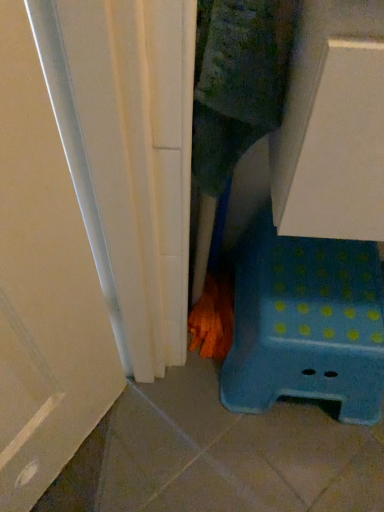
Question: Is orange textured broom at lower center to the right of blue plastic stool at lower right from the viewer's perspective?

Choices:
 (A) no
 (B) yes

Answer: (A)

Question: Is there a large distance between orange textured broom at lower center and blue plastic stool at lower right?

Choices:
 (A) no
 (B) yes

Answer: (A)

Question: Considering the relative sizes of orange textured broom at lower center and blue plastic stool at lower right in the image provided, is orange textured broom at lower center smaller than blue plastic stool at lower right?

Choices:
 (A) no
 (B) yes

Answer: (B)

Question: Is the depth of orange textured broom at lower center greater than that of blue plastic stool at lower right?

Choices:
 (A) yes
 (B) no

Answer: (A)

Question: Is orange textured broom at lower center positioned in front of blue plastic stool at lower right?

Choices:
 (A) no
 (B) yes

Answer: (A)

Question: Is orange textured broom at lower center shorter than blue plastic stool at lower right?

Choices:
 (A) no
 (B) yes

Answer: (B)

Question: Is blue plastic stool at lower right beside orange textured broom at lower center?

Choices:
 (A) no
 (B) yes

Answer: (A)

Question: Is the position of blue plastic stool at lower right less distant than that of orange textured broom at lower center?

Choices:
 (A) no
 (B) yes

Answer: (B)

Question: Does blue plastic stool at lower right have a lesser height compared to orange textured broom at lower center?

Choices:
 (A) no
 (B) yes

Answer: (A)

Question: Is blue plastic stool at lower right completely or partially outside of orange textured broom at lower center?

Choices:
 (A) no
 (B) yes

Answer: (B)

Question: Could you tell me if blue plastic stool at lower right is facing orange textured broom at lower center?

Choices:
 (A) yes
 (B) no

Answer: (B)

Question: Can you confirm if blue plastic stool at lower right is positioned to the right of orange textured broom at lower center?

Choices:
 (A) yes
 (B) no

Answer: (A)

Question: Considering the positions of orange textured broom at lower center and blue plastic stool at lower right in the image, is orange textured broom at lower center wider or thinner than blue plastic stool at lower right?

Choices:
 (A) wide
 (B) thin

Answer: (B)